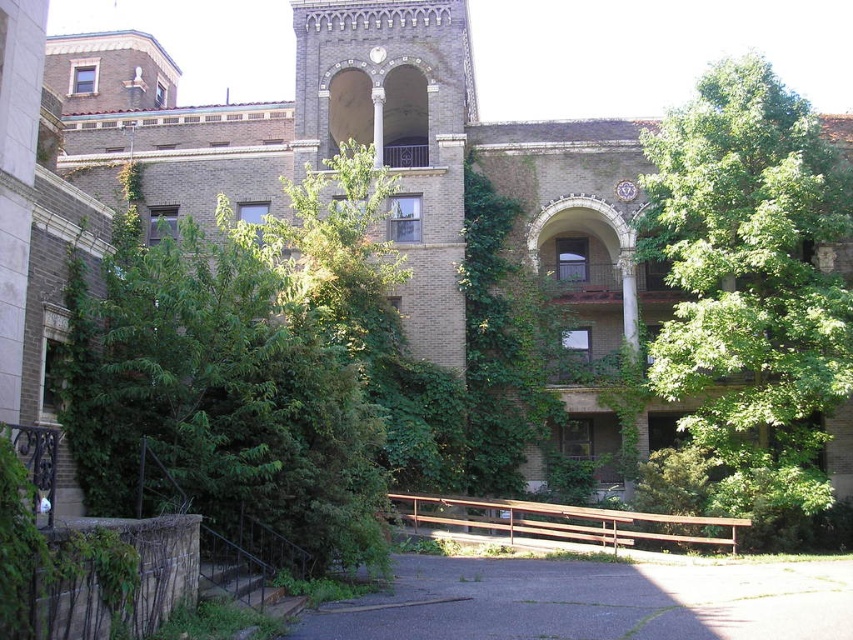
Question: Is green leafy tree at center wider than green leafy tree at upper right?

Choices:
 (A) yes
 (B) no

Answer: (A)

Question: In this image, where is green leafy tree at center located relative to green leafy tree at upper right?

Choices:
 (A) right
 (B) left

Answer: (B)

Question: Is green leafy tree at center positioned at the back of green leafy tree at upper right?

Choices:
 (A) yes
 (B) no

Answer: (B)

Question: Which point appears closest to the camera in this image?

Choices:
 (A) (782, 104)
 (B) (244, 464)

Answer: (B)

Question: Which point is closer to the camera taking this photo?

Choices:
 (A) (822, 497)
 (B) (248, 502)

Answer: (B)